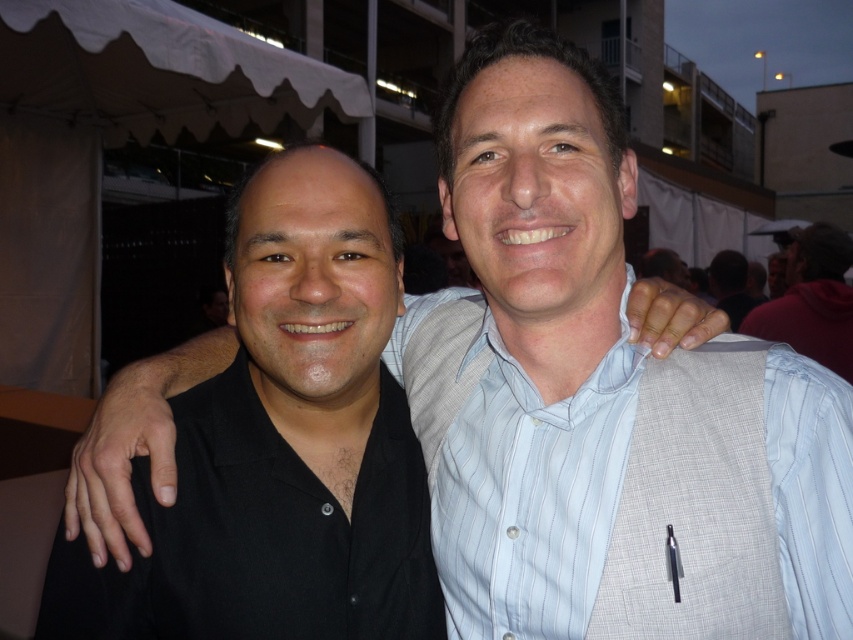
Question: Which point appears farthest from the camera in this image?

Choices:
 (A) (601, 540)
 (B) (795, 320)

Answer: (B)

Question: Does light blue striped shirt at center lie in front of white striped shirt at upper right?

Choices:
 (A) no
 (B) yes

Answer: (B)

Question: Which point is farther to the camera?

Choices:
 (A) (502, 433)
 (B) (817, 221)

Answer: (B)

Question: Does light blue striped shirt at center appear on the left side of white striped shirt at upper right?

Choices:
 (A) no
 (B) yes

Answer: (B)

Question: Does light blue striped shirt at center have a greater width compared to white striped shirt at upper right?

Choices:
 (A) yes
 (B) no

Answer: (B)